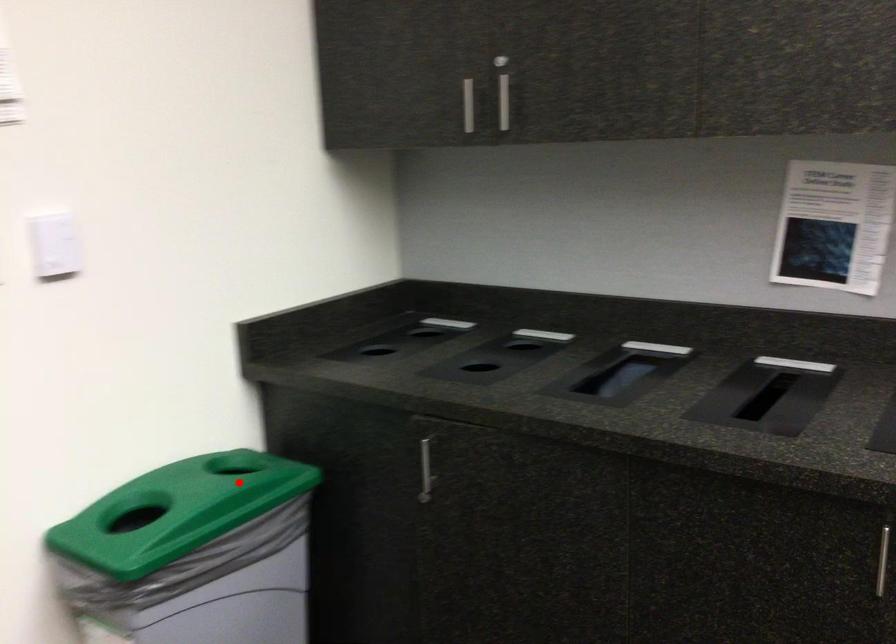
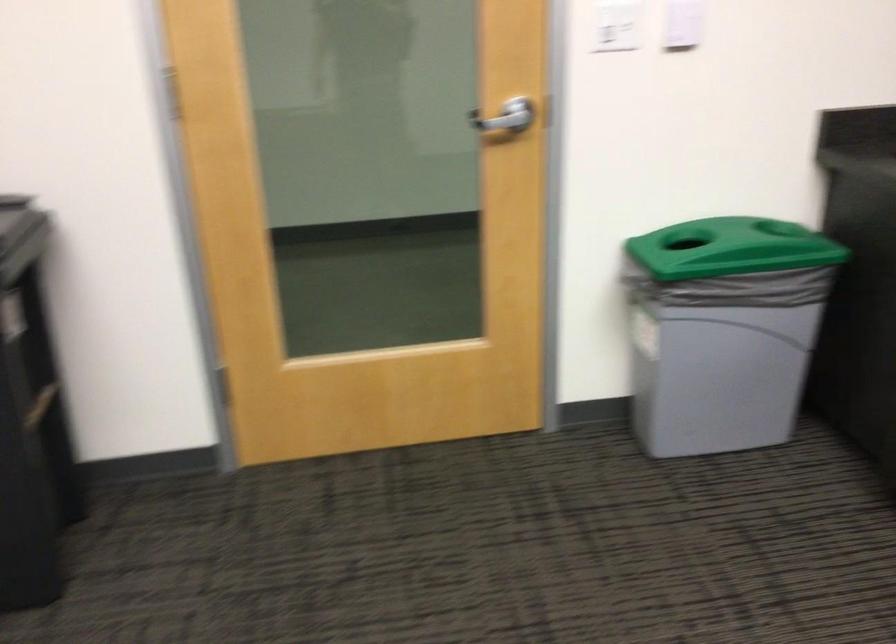
Find the pixel in the second image that matches the highlighted location in the first image.

(759, 238)